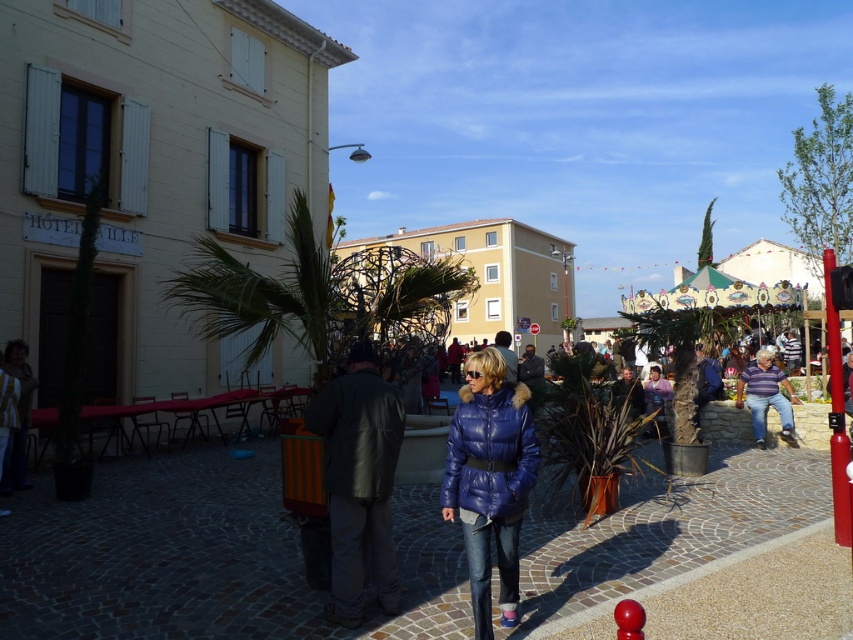
Question: Observing the image, what is the correct spatial positioning of blue down jacket at center in reference to striped cotton shirt at center?

Choices:
 (A) left
 (B) right

Answer: (A)

Question: Does blue down jacket at center have a greater width compared to striped cotton shirt at center?

Choices:
 (A) no
 (B) yes

Answer: (A)

Question: Estimate the real-world distances between objects in this image. Which object is farther from the striped cotton shirt at center?

Choices:
 (A) dark gray leather jacket at center
 (B) blue down jacket at center

Answer: (A)

Question: Which object appears farthest from the camera in this image?

Choices:
 (A) dark gray leather jacket at center
 (B) striped cotton shirt at center
 (C) blue down jacket at center

Answer: (B)

Question: Which of the following is the closest to the observer?

Choices:
 (A) (375, 488)
 (B) (517, 428)
 (C) (747, 371)

Answer: (B)

Question: Does blue down jacket at center have a smaller size compared to striped cotton shirt at center?

Choices:
 (A) no
 (B) yes

Answer: (B)